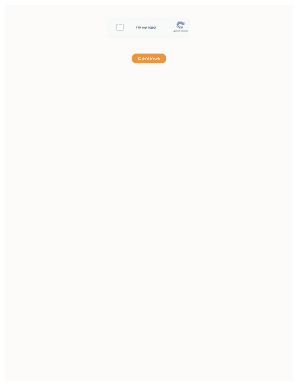
Find the location of a particular element. This screenshot has width=298, height=386. box is located at coordinates (119, 26).